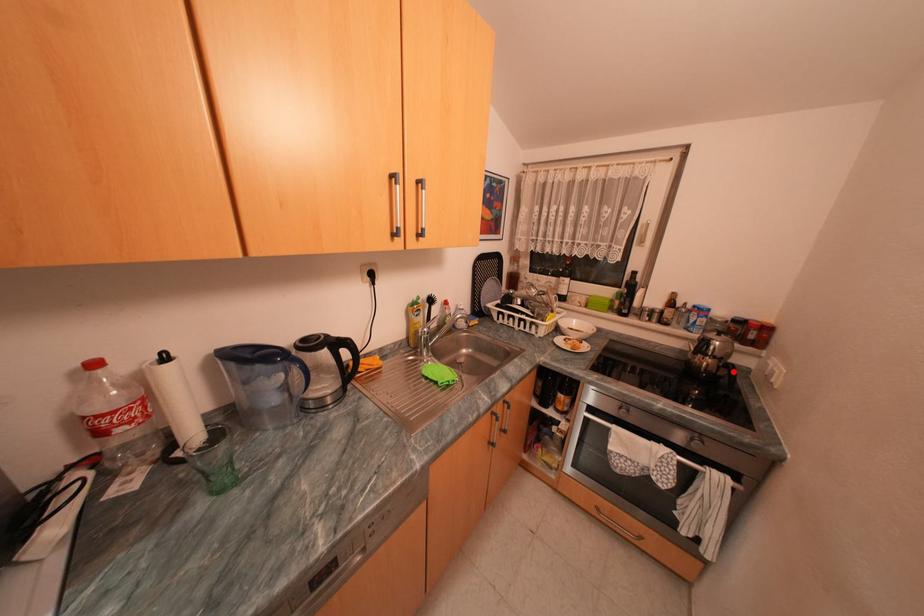
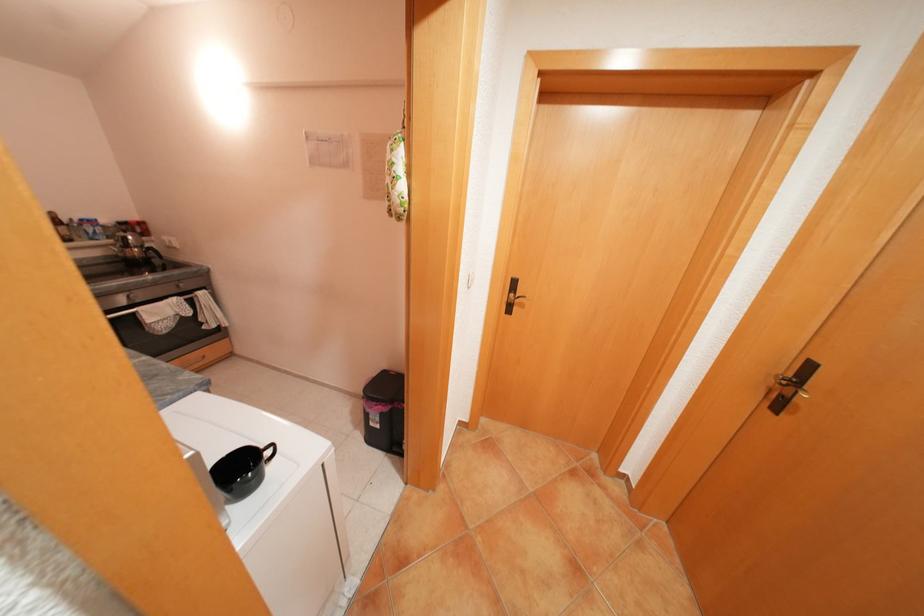
The point at the highlighted location is marked in the first image. Where is the corresponding point in the second image?

(160, 253)